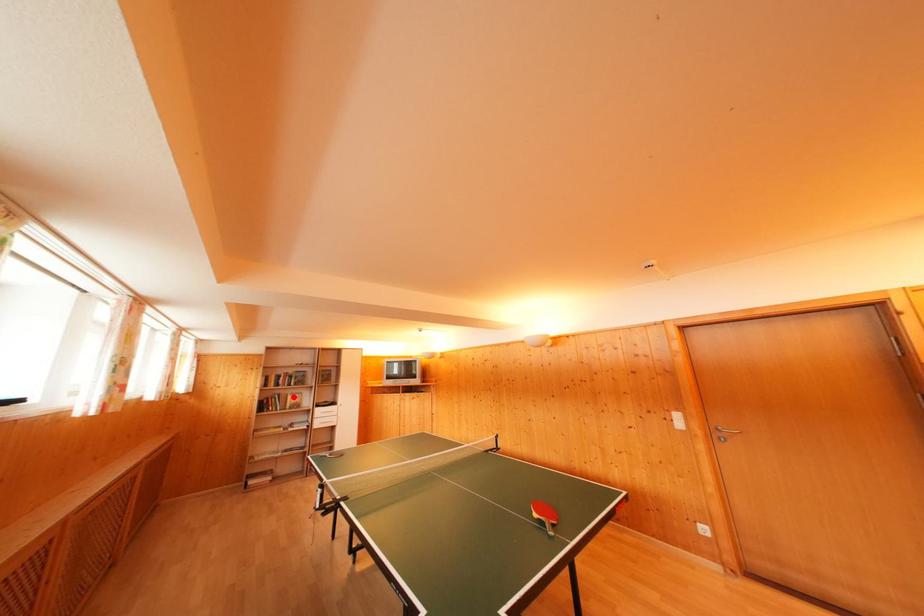
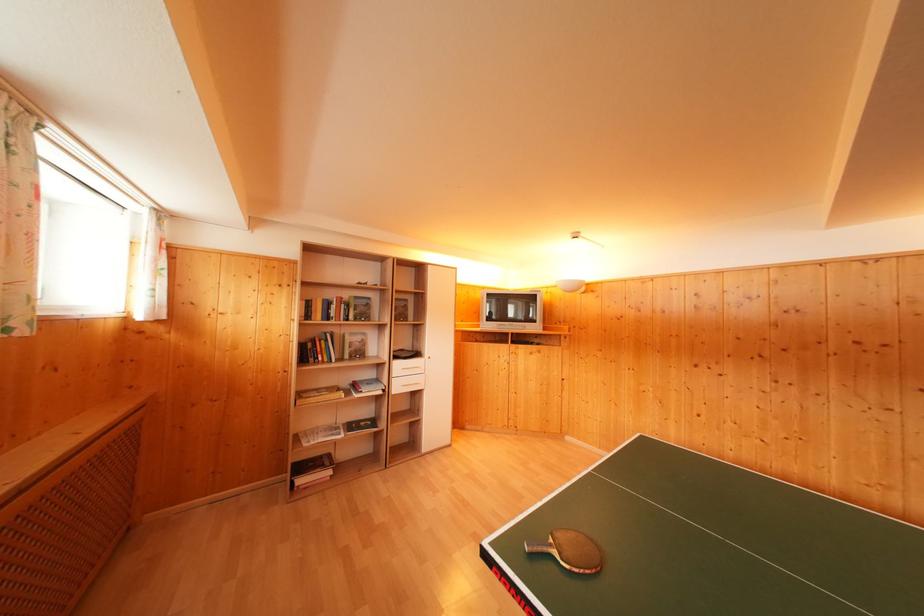
Question: A red point is marked in image1. In image2, is the corresponding 3D point closer to the camera or farther? Reply with the corresponding letter.

Choices:
 (A) The corresponding 3D point is closer.
 (B) The corresponding 3D point is farther.

Answer: (A)